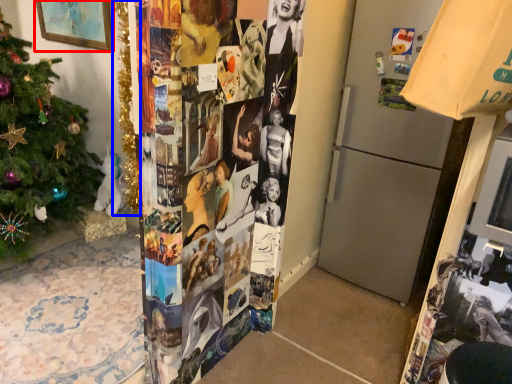
Question: Which of the following is the farthest to the observer, picture frame (highlighted by a red box) or christmas tree (highlighted by a blue box)?

Choices:
 (A) picture frame
 (B) christmas tree

Answer: (A)